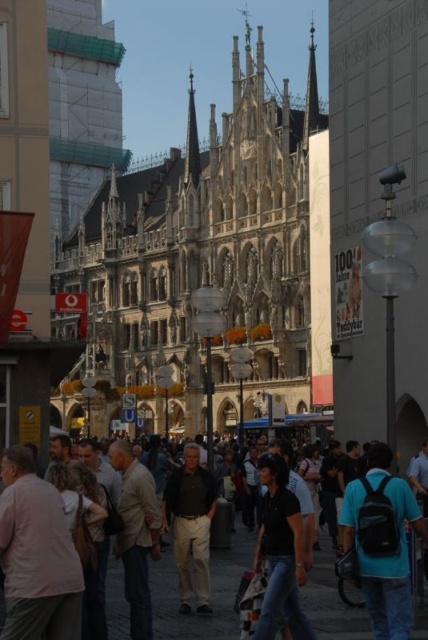
Does light pink shirt at center have a lesser width compared to teal backpack at center?

In fact, light pink shirt at center might be wider than teal backpack at center.

Between point (35, 484) and point (345, 524), which one is positioned in front?

Positioned in front is point (35, 484).

Which is in front, point (27, 620) or point (386, 552)?

Point (27, 620) is more forward.

Locate an element on the screen. light pink shirt at center is located at coordinates (36, 556).

Is stone gothic church at center positioned before dark clothing crowd at center?

No.

Which is more to the left, stone gothic church at center or dark clothing crowd at center?

stone gothic church at center

Does point (237, 228) lie in front of point (216, 588)?

No, (237, 228) is further to viewer.

This screenshot has height=640, width=428. I want to click on stone gothic church at center, so pyautogui.click(x=202, y=268).

In the scene shown: Who is taller, teal backpack at center or light beige jacket at center?

light beige jacket at center is taller.

Is teal backpack at center wider than light beige jacket at center?

Incorrect, teal backpack at center's width does not surpass light beige jacket at center's.

What do you see at coordinates (382, 541) in the screenshot?
I see `teal backpack at center` at bounding box center [382, 541].

Where is `teal backpack at center`? The image size is (428, 640). teal backpack at center is located at coordinates (382, 541).